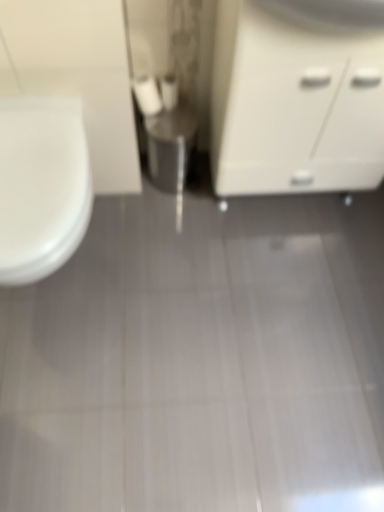
The image size is (384, 512). I want to click on vacant space in between white glossy toilet at left and white matte cabinet at right, so click(188, 247).